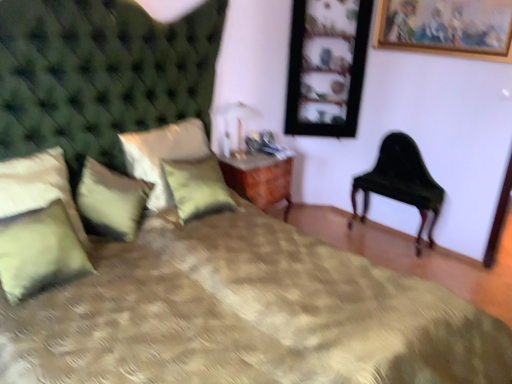
Question: Can you confirm if metallic gold table lamp at upper center is shorter than wooden nightstand at center?

Choices:
 (A) no
 (B) yes

Answer: (B)

Question: Is the position of metallic gold table lamp at upper center more distant than that of wooden nightstand at center?

Choices:
 (A) no
 (B) yes

Answer: (A)

Question: Is metallic gold table lamp at upper center facing away from wooden nightstand at center?

Choices:
 (A) yes
 (B) no

Answer: (B)

Question: Is metallic gold table lamp at upper center taller than wooden nightstand at center?

Choices:
 (A) no
 (B) yes

Answer: (A)

Question: Is metallic gold table lamp at upper center outside wooden nightstand at center?

Choices:
 (A) yes
 (B) no

Answer: (A)

Question: Considering the positions of gold-framed picture at upper right, the second picture frame in the back-to-front sequence, and wooden picture frame at upper right, the 2th picture frame in the right-to-left sequence, in the image, is gold-framed picture at upper right, the second picture frame in the back-to-front sequence, bigger or smaller than wooden picture frame at upper right, the 2th picture frame in the right-to-left sequence,?

Choices:
 (A) small
 (B) big

Answer: (A)

Question: Is gold-framed picture at upper right, the second picture frame in the back-to-front sequence, in front of or behind wooden picture frame at upper right, placed as the 1th picture frame when sorted from left to right, in the image?

Choices:
 (A) front
 (B) behind

Answer: (A)

Question: In the image, is gold-framed picture at upper right, the second picture frame when ordered from left to right, on the left side or the right side of wooden picture frame at upper right, placed as the 1th picture frame when sorted from left to right?

Choices:
 (A) right
 (B) left

Answer: (A)

Question: From a real-world perspective, relative to wooden picture frame at upper right, placed as the 1th picture frame when sorted from left to right, is gold-framed picture at upper right, the second picture frame in the back-to-front sequence, vertically above or below?

Choices:
 (A) below
 (B) above

Answer: (B)

Question: From a real-world perspective, is green velvet pillow at lower left, the fourth pillow when ordered from right to left, above or below wooden nightstand at center?

Choices:
 (A) above
 (B) below

Answer: (A)

Question: From the image's perspective, is green velvet pillow at lower left, which is counted as the second pillow, starting from the left, positioned above or below wooden nightstand at center?

Choices:
 (A) below
 (B) above

Answer: (A)

Question: In the image, is green velvet pillow at lower left, which is counted as the second pillow, starting from the left, on the left side or the right side of wooden nightstand at center?

Choices:
 (A) right
 (B) left

Answer: (B)

Question: Based on their sizes in the image, would you say green velvet pillow at lower left, the fourth pillow when ordered from right to left, is bigger or smaller than wooden nightstand at center?

Choices:
 (A) small
 (B) big

Answer: (A)

Question: In terms of size, does wooden picture frame at upper right, the 2th picture frame in the right-to-left sequence, appear bigger or smaller than green textured pillow at center, placed as the 4th pillow when sorted from left to right?

Choices:
 (A) small
 (B) big

Answer: (B)

Question: From the image's perspective, is wooden picture frame at upper right, placed as the 1th picture frame when sorted from left to right, above or below green textured pillow at center, placed as the 4th pillow when sorted from left to right?

Choices:
 (A) below
 (B) above

Answer: (B)